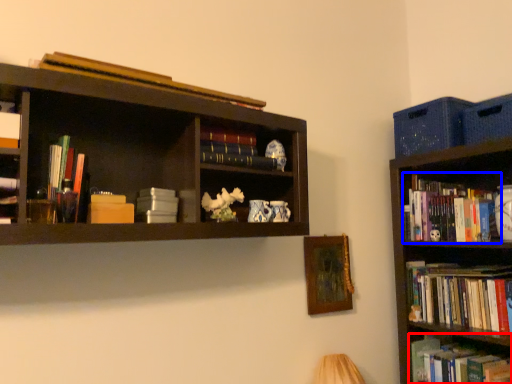
Question: Among these objects, which one is farthest to the camera, book (highlighted by a red box) or book (highlighted by a blue box)?

Choices:
 (A) book
 (B) book

Answer: (B)